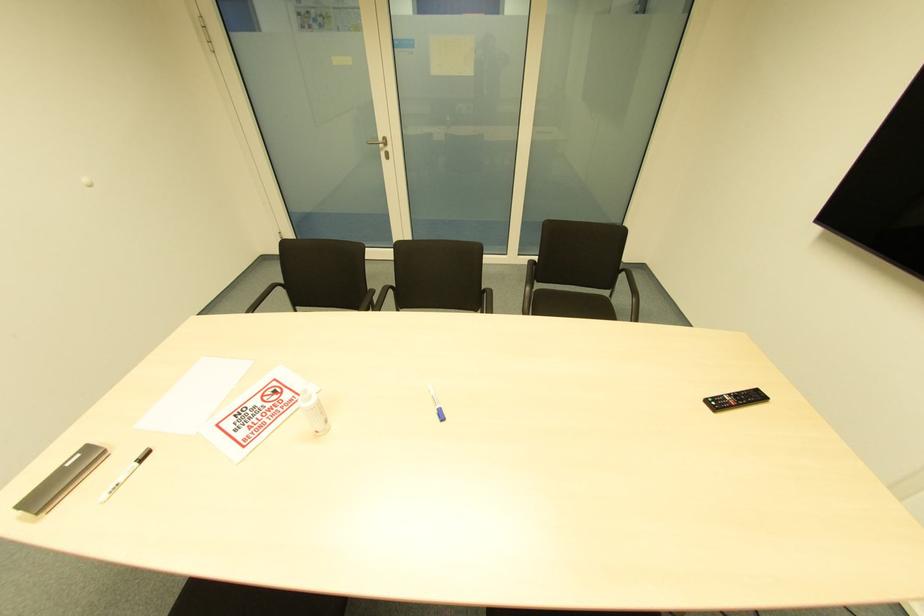
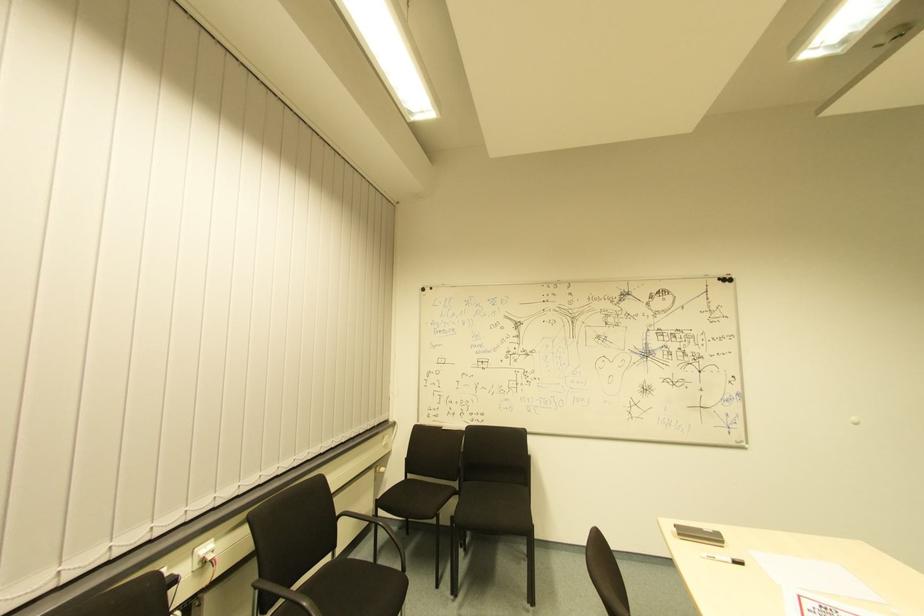
Find the pixel in the second image that matches the point at 144,456 in the first image.

(737, 565)